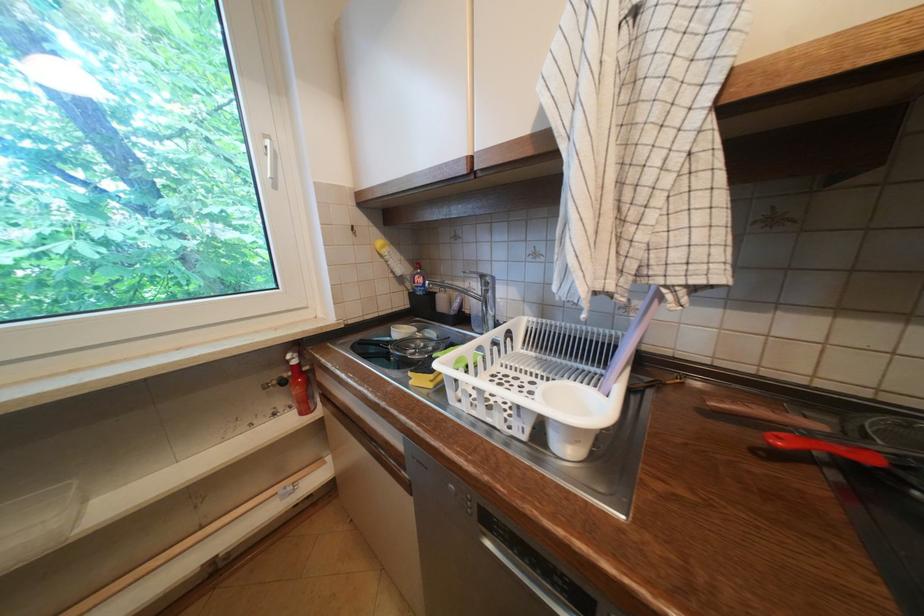
Where would you lift the faucet handle? Please return your answer as a coordinate pair (x, y).

(475, 299)